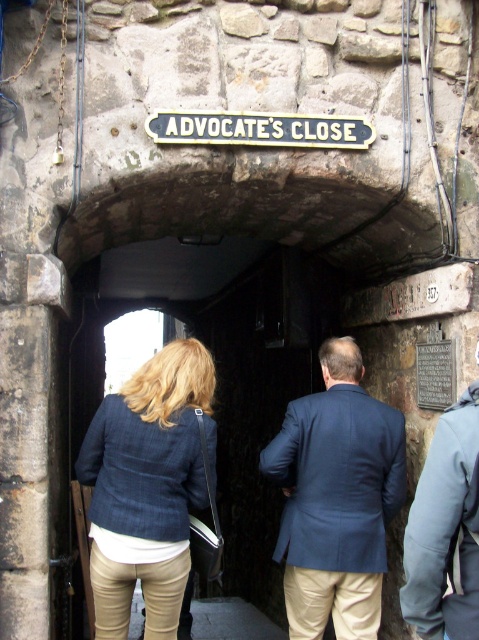
Question: Is blue fabric jacket at center further to camera compared to metallic green sign at center?

Choices:
 (A) yes
 (B) no

Answer: (A)

Question: Does denim jacket at center have a greater width compared to blue fabric coat at center?

Choices:
 (A) yes
 (B) no

Answer: (A)

Question: Among these objects, which one is farthest from the camera?

Choices:
 (A) denim jacket at center
 (B) blue fabric coat at center
 (C) metallic green sign at center
 (D) blue fabric jacket at center

Answer: (D)

Question: Is denim jacket at center in front of blue textured blazer at center?

Choices:
 (A) yes
 (B) no

Answer: (A)

Question: Which object is the farthest from the metallic green sign at center?

Choices:
 (A) blue fabric jacket at center
 (B) denim jacket at center

Answer: (A)

Question: Which object appears farthest from the camera in this image?

Choices:
 (A) metallic green sign at center
 (B) blue fabric jacket at center
 (C) blue fabric coat at center
 (D) blue textured blazer at center

Answer: (B)